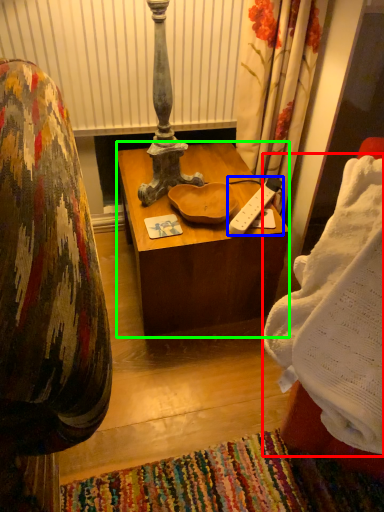
Question: Estimate the real-world distances between objects in this image. Which object is closer to blanket (highlighted by a red box), remote control (highlighted by a blue box) or desk (highlighted by a green box)?

Choices:
 (A) remote control
 (B) desk

Answer: (A)